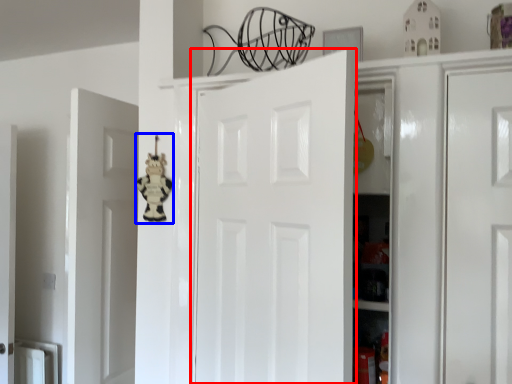
Question: Which point is closer to the camera, door (highlighted by a red box) or toy (highlighted by a blue box)?

Choices:
 (A) door
 (B) toy

Answer: (A)